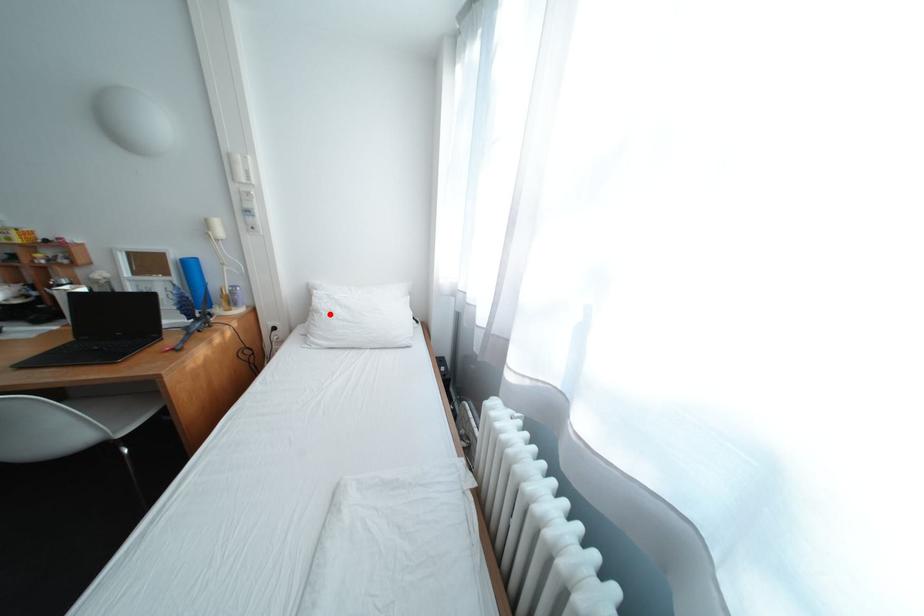
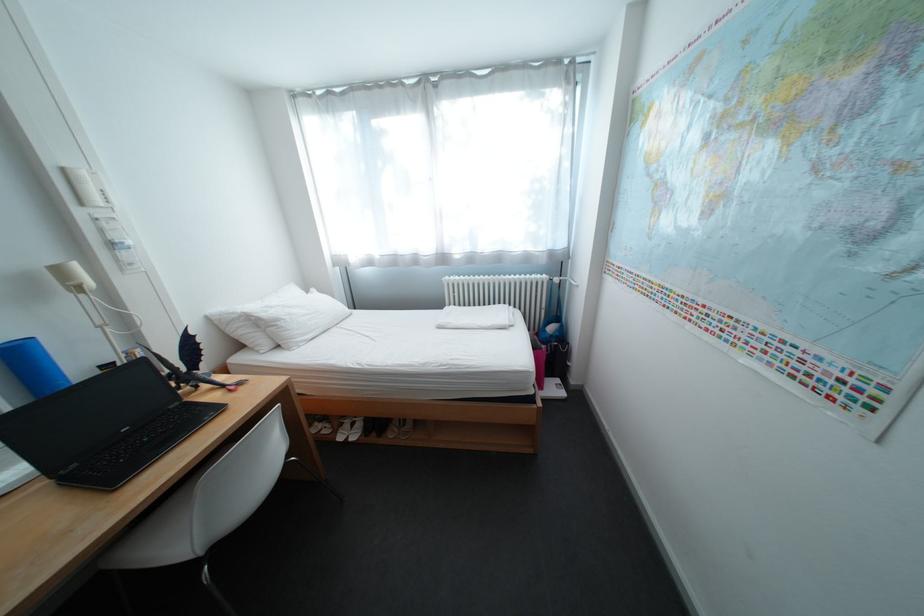
Locate, in the second image, the point that corresponds to the highlighted location in the first image.

(292, 322)